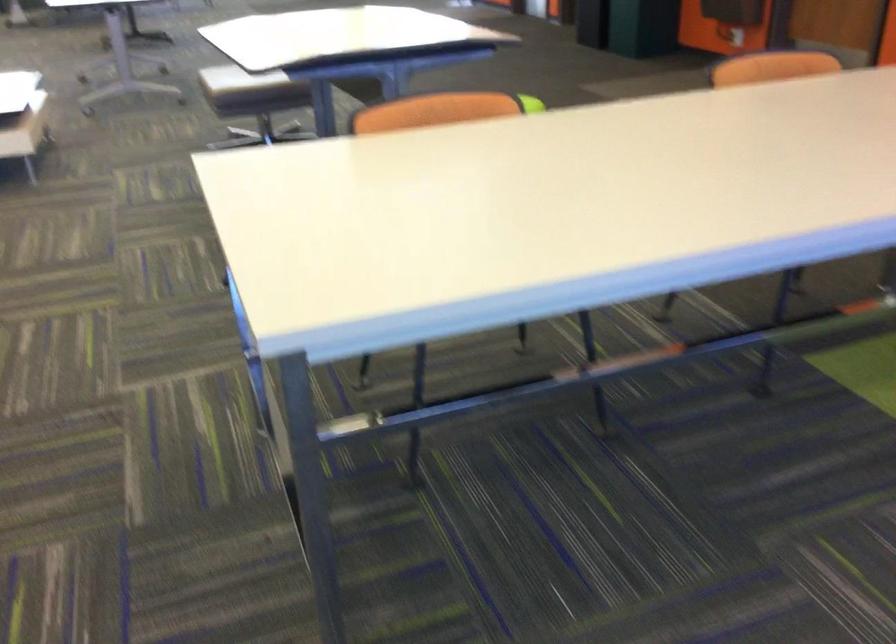
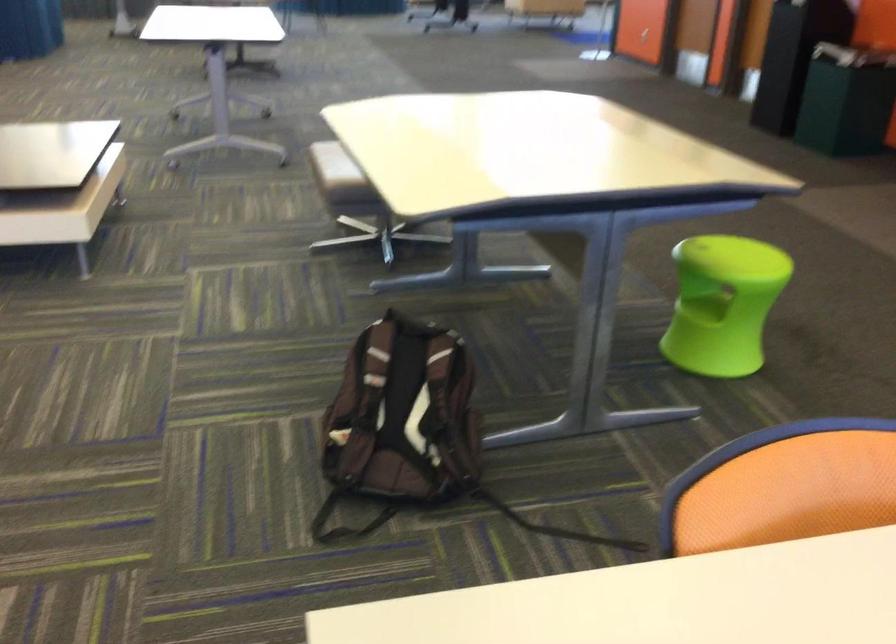
Locate, in the second image, the point that corresponds to pixel 427 140 in the first image.

(832, 585)